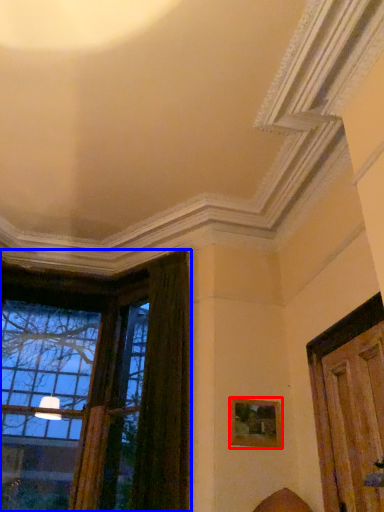
Question: Which of the following is the farthest to the observer, picture frame (highlighted by a red box) or window (highlighted by a blue box)?

Choices:
 (A) picture frame
 (B) window

Answer: (B)